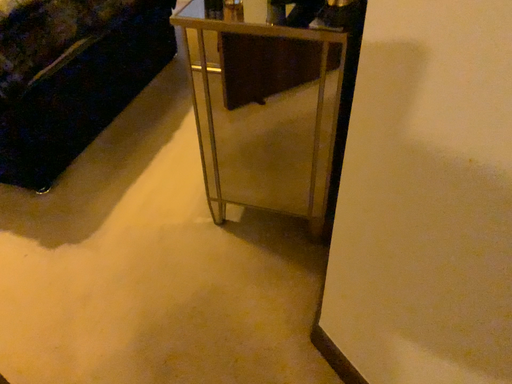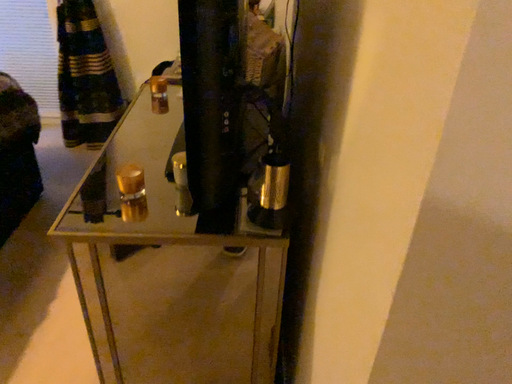
Question: How did the camera likely rotate when shooting the video?

Choices:
 (A) rotated right
 (B) rotated left

Answer: (A)